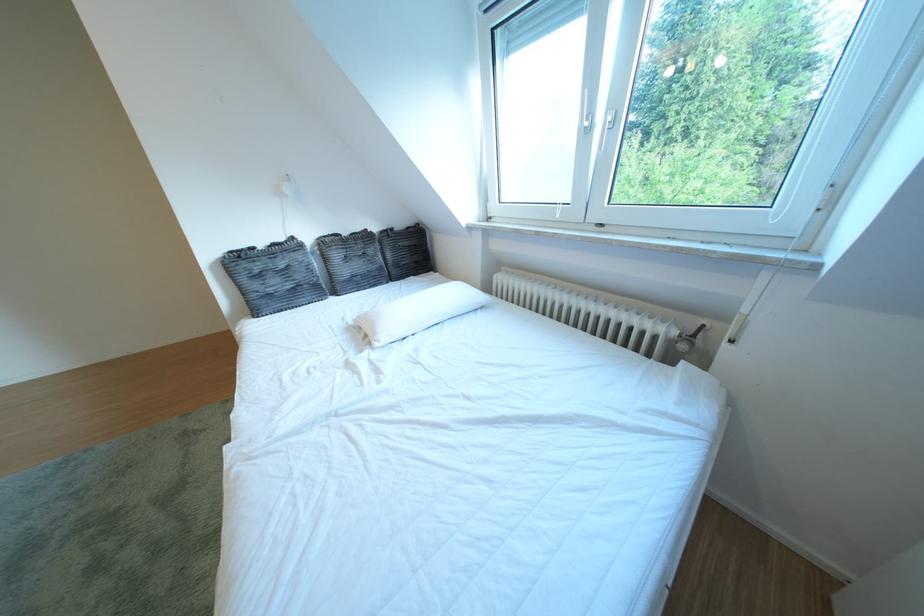
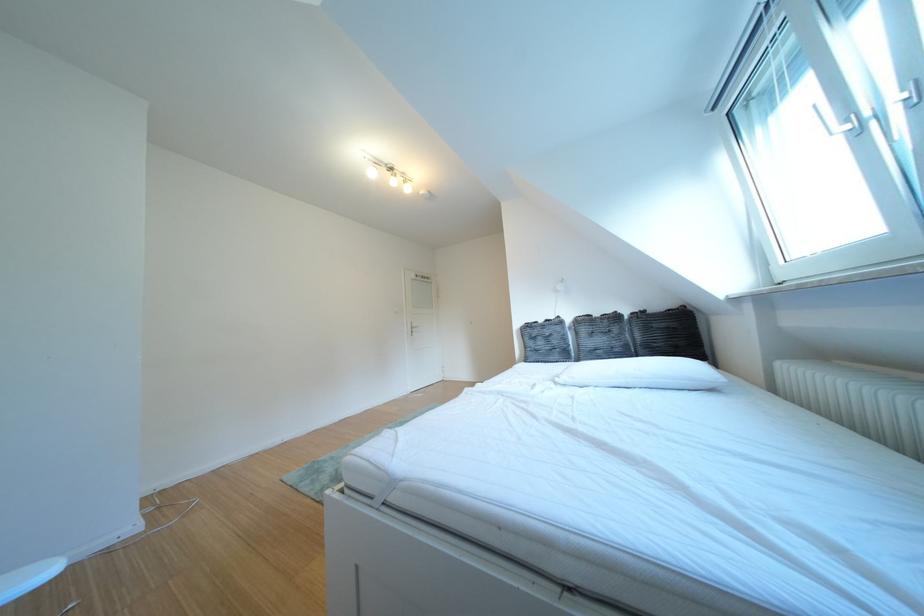
Question: How did the camera likely rotate?

Choices:
 (A) Left
 (B) Right
 (C) Up
 (D) Down

Answer: (A)